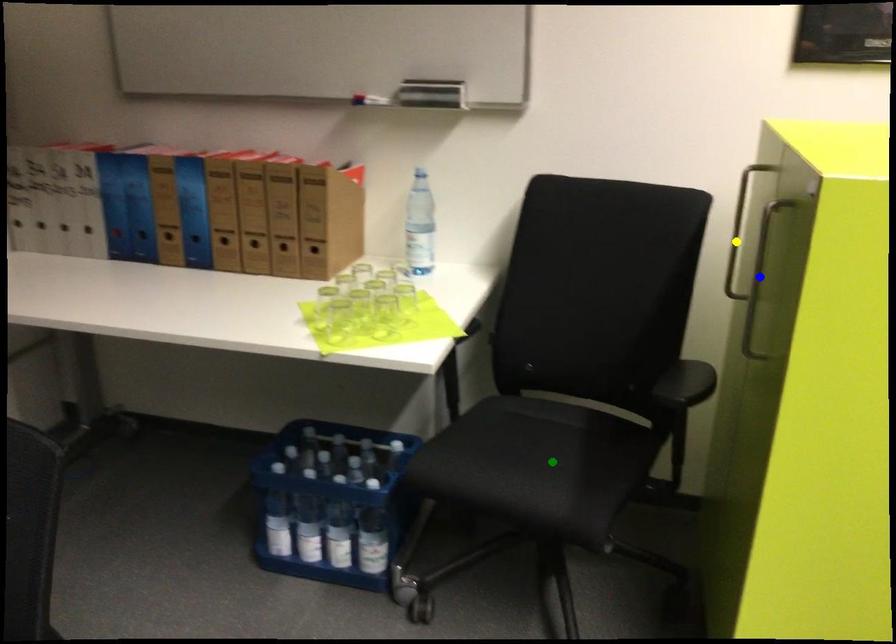
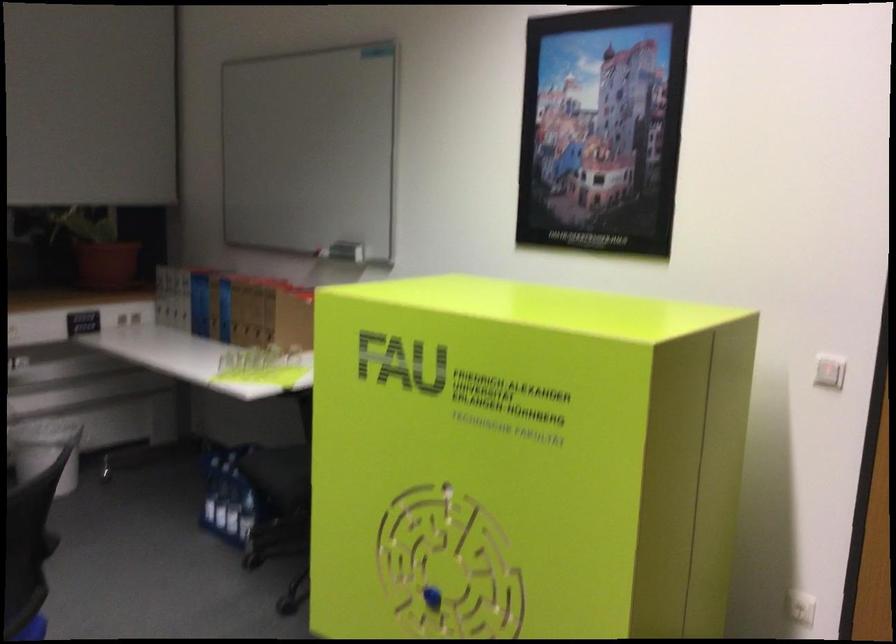
I am providing you with two images of the same scene from different viewpoints. Three points are marked in image1. Which point corresponds to a part or object that is occluded in image2?In image1, three points are marked. Which of them correspond to a part or object that is occluded in image2?Among the three points shown in image1, which one corresponds to a part or object that is no longer visible due to occlusion in image2?

Invisible in image2: yellow point, green point, blue point.